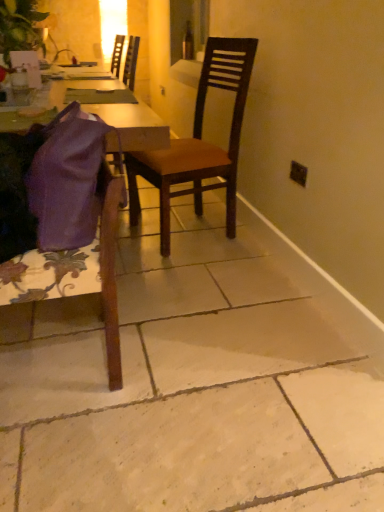
What do you see at coordinates (61, 218) in the screenshot? Image resolution: width=384 pixels, height=512 pixels. I see `purple fabric bag at lower left, the 2th chair from the back` at bounding box center [61, 218].

The height and width of the screenshot is (512, 384). What do you see at coordinates (199, 142) in the screenshot? I see `brown wooden chair at center, arranged as the second chair when viewed from the front` at bounding box center [199, 142].

The height and width of the screenshot is (512, 384). What are the coordinates of `green leafy plant at upper left` in the screenshot? It's located at (20, 27).

Describe the element at coordinates (20, 27) in the screenshot. The width and height of the screenshot is (384, 512). I see `green leafy plant at upper left` at that location.

Identify the location of purple fabric at left. Image resolution: width=384 pixels, height=512 pixels. [133, 125].

Is green leafy plant at upper left oriented towards transparent glass bottle at center?

No, green leafy plant at upper left does not turn towards transparent glass bottle at center.

Consider the image. In terms of width, does green leafy plant at upper left look wider or thinner when compared to transparent glass bottle at center?

Clearly, green leafy plant at upper left has more width compared to transparent glass bottle at center.

Can you tell me how much green leafy plant at upper left and transparent glass bottle at center differ in facing direction?

The facing directions of green leafy plant at upper left and transparent glass bottle at center are 91.3 degrees apart.

Which object is further away from the camera, green leafy plant at upper left or transparent glass bottle at center?

transparent glass bottle at center.

Locate an element on the screen. This screenshot has height=512, width=384. houseplant located behind the black plastic power outlet at upper right is located at coordinates (20, 27).

Is black plastic power outlet at upper right positioned far away from green leafy plant at upper left?

black plastic power outlet at upper right is positioned a significant distance from green leafy plant at upper left.

Considering the relative sizes of black plastic power outlet at upper right and green leafy plant at upper left in the image provided, is black plastic power outlet at upper right taller than green leafy plant at upper left?

In fact, black plastic power outlet at upper right may be shorter than green leafy plant at upper left.

How distant is black plastic power outlet at upper right from green leafy plant at upper left?

black plastic power outlet at upper right is 1.58 meters from green leafy plant at upper left.

Is green leafy plant at upper left far away from purple fabric at left?

No, there isn't a large distance between green leafy plant at upper left and purple fabric at left.

From a real-world perspective, is green leafy plant at upper left above or below purple fabric at left?

In terms of real-world spatial position, green leafy plant at upper left is above purple fabric at left.

Does point (44, 18) come behind point (85, 86)?

Yes, it is behind point (85, 86).

Which is more to the right, brown wooden chair at center, the 1th chair when ordered from back to front, or transparent glass bottle at center?

brown wooden chair at center, the 1th chair when ordered from back to front.

From a real-world perspective, is brown wooden chair at center, arranged as the second chair when viewed from the front, above or below transparent glass bottle at center?

brown wooden chair at center, arranged as the second chair when viewed from the front, is below transparent glass bottle at center.

Can you tell me how much brown wooden chair at center, arranged as the second chair when viewed from the front, and transparent glass bottle at center differ in facing direction?

12 degrees separate the facing orientations of brown wooden chair at center, arranged as the second chair when viewed from the front, and transparent glass bottle at center.

Is purple fabric bag at lower left, the 2th chair from the back, shorter than black plastic power outlet at upper right?

In fact, purple fabric bag at lower left, the 2th chair from the back, may be taller than black plastic power outlet at upper right.

Can we say purple fabric bag at lower left, the 2th chair from the back, lies outside black plastic power outlet at upper right?

Yes, purple fabric bag at lower left, the 2th chair from the back, is located beyond the bounds of black plastic power outlet at upper right.

Does purple fabric bag at lower left, the 2th chair from the back, turn towards black plastic power outlet at upper right?

No, purple fabric bag at lower left, the 2th chair from the back, does not turn towards black plastic power outlet at upper right.

Can you confirm if purple fabric bag at lower left, the 2th chair from the back, is smaller than black plastic power outlet at upper right?

No, purple fabric bag at lower left, the 2th chair from the back, is not smaller than black plastic power outlet at upper right.

Between purple fabric at left and purple fabric bag at lower left, the 1th chair from the front, which one has less height?

purple fabric bag at lower left, the 1th chair from the front, is shorter.

Is purple fabric at left oriented towards purple fabric bag at lower left, the 2th chair from the back?

No, purple fabric at left is not oriented towards purple fabric bag at lower left, the 2th chair from the back.

From the image's perspective, is purple fabric at left below purple fabric bag at lower left, the 1th chair from the front?

Actually, purple fabric at left appears above purple fabric bag at lower left, the 1th chair from the front, in the image.

Is purple fabric bag at lower left, the 2th chair from the back, located within purple fabric at left?

No, purple fabric bag at lower left, the 2th chair from the back, is not inside purple fabric at left.

Considering the relative sizes of purple fabric bag at lower left, the 1th chair from the front, and purple fabric at left in the image provided, is purple fabric bag at lower left, the 1th chair from the front, shorter than purple fabric at left?

Correct, purple fabric bag at lower left, the 1th chair from the front, is not as tall as purple fabric at left.

From the image's perspective, relative to purple fabric at left, is purple fabric bag at lower left, the 2th chair from the back, above or below?

Clearly, from the image's perspective, purple fabric bag at lower left, the 2th chair from the back, is below purple fabric at left.

Which object is more forward, purple fabric bag at lower left, the 2th chair from the back, or purple fabric at left?

purple fabric bag at lower left, the 2th chair from the back, is closer to the camera.

What are the coordinates of `bottle lying on the right of green leafy plant at upper left` in the screenshot? It's located at (188, 42).

Locate an element on the screen. The width and height of the screenshot is (384, 512). houseplant behind the black plastic power outlet at upper right is located at coordinates (20, 27).

Estimate the real-world distances between objects in this image. Which object is closer to brown wooden chair at center, the 1th chair when ordered from back to front, transparent glass bottle at center or green leafy plant at upper left?

green leafy plant at upper left is closer to brown wooden chair at center, the 1th chair when ordered from back to front.

Considering their positions, is purple fabric at left positioned closer to brown wooden chair at center, the 1th chair when ordered from back to front, than purple fabric bag at lower left, the 2th chair from the back?

purple fabric at left lies closer to brown wooden chair at center, the 1th chair when ordered from back to front, than the other object.

From the image, which object appears to be nearer to brown wooden chair at center, the 1th chair when ordered from back to front, transparent glass bottle at center or black plastic power outlet at upper right?

black plastic power outlet at upper right is closer to brown wooden chair at center, the 1th chair when ordered from back to front.

When comparing their distances from black plastic power outlet at upper right, does purple fabric bag at lower left, the 2th chair from the back, or transparent glass bottle at center seem further?

transparent glass bottle at center is positioned further to the anchor black plastic power outlet at upper right.

Which object lies nearer to the anchor point purple fabric bag at lower left, the 2th chair from the back, black plastic power outlet at upper right or brown wooden chair at center, the 1th chair when ordered from back to front?

Based on the image, brown wooden chair at center, the 1th chair when ordered from back to front, appears to be nearer to purple fabric bag at lower left, the 2th chair from the back.

Looking at the image, which one is located further to brown wooden chair at center, the 1th chair when ordered from back to front, black plastic power outlet at upper right or purple fabric bag at lower left, the 2th chair from the back?

purple fabric bag at lower left, the 2th chair from the back.

Which object lies further to the anchor point purple fabric at left, green leafy plant at upper left or brown wooden chair at center, arranged as the second chair when viewed from the front?

Among the two, green leafy plant at upper left is located further to purple fabric at left.

From the image, which object appears to be farther from brown wooden chair at center, the 1th chair when ordered from back to front, black plastic power outlet at upper right or purple fabric at left?

The object further to brown wooden chair at center, the 1th chair when ordered from back to front, is black plastic power outlet at upper right.

The height and width of the screenshot is (512, 384). I want to click on houseplant between brown wooden chair at center, the 1th chair when ordered from back to front, and transparent glass bottle at center, along the z-axis, so click(x=20, y=27).

Locate an element on the screen. Image resolution: width=384 pixels, height=512 pixels. chair located between purple fabric bag at lower left, the 1th chair from the front, and purple fabric at left in the depth direction is located at coordinates (199, 142).

At what (x,y) coordinates should I click in order to perform the action: click on power outlet between brown wooden chair at center, arranged as the second chair when viewed from the front, and transparent glass bottle at center from front to back. Please return your answer as a coordinate pair (x, y). This screenshot has width=384, height=512. Looking at the image, I should click on (298, 173).

Find the location of a particular element. The image size is (384, 512). houseplant positioned between black plastic power outlet at upper right and transparent glass bottle at center from near to far is located at coordinates (20, 27).